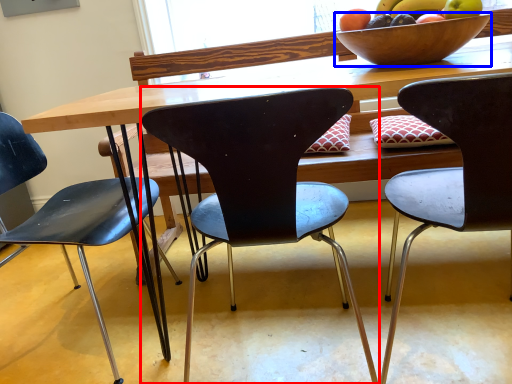
Question: Which point is closer to the camera, chair (highlighted by a red box) or bowl (highlighted by a blue box)?

Choices:
 (A) chair
 (B) bowl

Answer: (A)